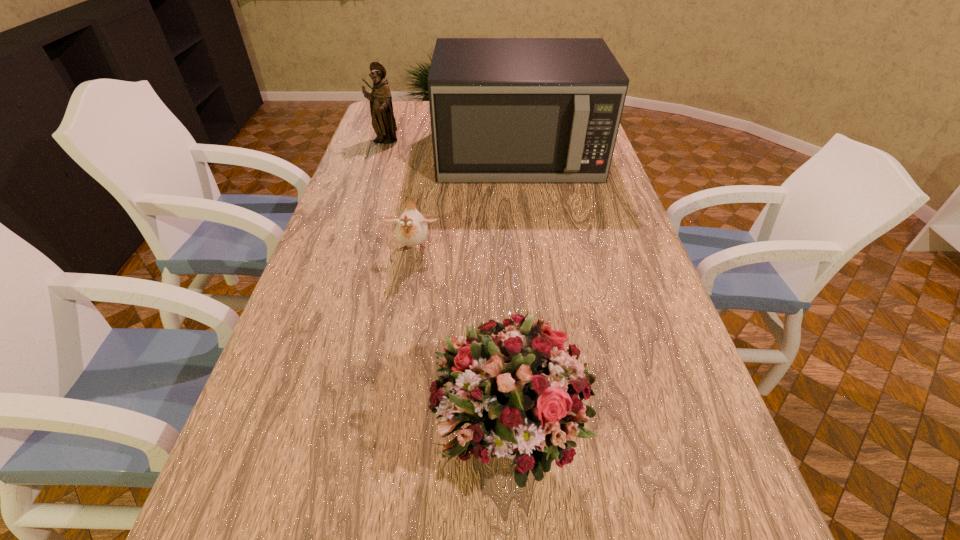
Locate an element on the screen. The image size is (960, 540). object at the right edge is located at coordinates (503, 110).

Locate an element on the screen. This screenshot has width=960, height=540. vacant space at the left edge of the desktop is located at coordinates (347, 191).

At what (x,y) coordinates should I click in order to perform the action: click on vacant space at the right edge. Please return your answer as a coordinate pair (x, y). Looking at the image, I should click on (603, 212).

Image resolution: width=960 pixels, height=540 pixels. What are the coordinates of `empty location between the figurine and the nearest object` in the screenshot? It's located at (447, 288).

Image resolution: width=960 pixels, height=540 pixels. What are the coordinates of `free spot between the leftmost object and the bouquet` in the screenshot? It's located at (447, 288).

Find the location of a particular element. This screenshot has width=960, height=540. vacant area that lies between the bird and the figurine is located at coordinates (399, 195).

At what (x,y) coordinates should I click in order to perform the action: click on free space between the leftmost object and the bird. Please return your answer as a coordinate pair (x, y). Looking at the image, I should click on (399, 195).

You are a GUI agent. You are given a task and a screenshot of the screen. Output one action in this format:
    pyautogui.click(x=<x>, y=<y>)
    Task: Click on the free space between the nearest object and the leftmost object
    
    Given the screenshot: What is the action you would take?
    pyautogui.click(x=447, y=288)

I want to click on vacant point located between the leftmost object and the bird, so click(399, 195).

The height and width of the screenshot is (540, 960). I want to click on blank region between the leftmost object and the nearest object, so click(447, 288).